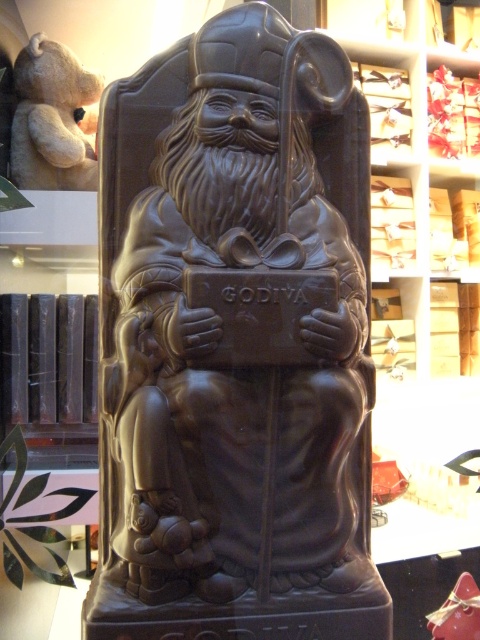
Question: Which point is farther to the camera?

Choices:
 (A) (273, 285)
 (B) (14, 180)

Answer: (B)

Question: Does matte chocolate sculpture at center have a larger size compared to soft beige teddy bear at upper left?

Choices:
 (A) no
 (B) yes

Answer: (B)

Question: Among these objects, which one is farthest from the camera?

Choices:
 (A) matte chocolate sculpture at center
 (B) soft beige teddy bear at upper left

Answer: (B)

Question: Does matte chocolate sculpture at center appear on the right side of soft beige teddy bear at upper left?

Choices:
 (A) yes
 (B) no

Answer: (A)

Question: Can you confirm if matte chocolate sculpture at center is wider than soft beige teddy bear at upper left?

Choices:
 (A) yes
 (B) no

Answer: (A)